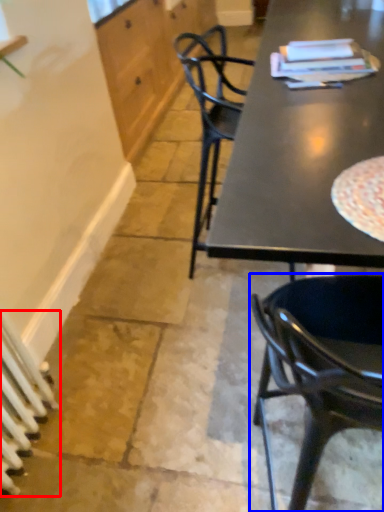
Question: Which object is closer to the camera taking this photo, radiator (highlighted by a red box) or chair (highlighted by a blue box)?

Choices:
 (A) radiator
 (B) chair

Answer: (B)